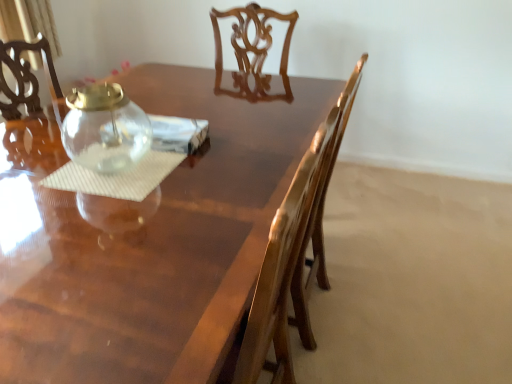
Where is `glossy wood table at center`? glossy wood table at center is located at coordinates (146, 240).

What do you see at coordinates (146, 240) in the screenshot?
I see `glossy wood table at center` at bounding box center [146, 240].

Locate an element on the screen. glossy wood table at center is located at coordinates (146, 240).